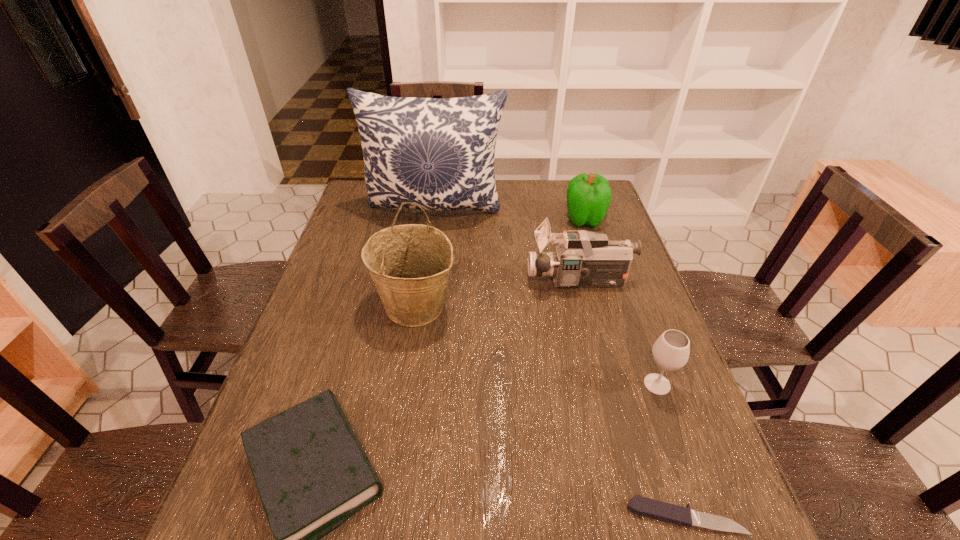
In order to click on vacant space located on the front-facing side of the camcorder in this screenshot , I will do `click(447, 281)`.

You are a GUI agent. You are given a task and a screenshot of the screen. Output one action in this format:
    pyautogui.click(x=<x>, y=<y>)
    Task: Click on the vacant area situated on the left of the bell pepper
    The height and width of the screenshot is (540, 960).
    Given the screenshot: What is the action you would take?
    pyautogui.click(x=472, y=220)

This screenshot has width=960, height=540. Identify the location of vacant position located 0.070m on the left of the third nearest object. (610, 384).

Locate an element on the screen. The image size is (960, 540). vacant space located on the back of the steak knife is located at coordinates (651, 411).

What are the coordinates of `cushion present at the far edge` in the screenshot? It's located at (438, 153).

Find the location of a particular element. Image resolution: width=960 pixels, height=540 pixels. bell pepper that is at the far edge is located at coordinates (588, 196).

At what (x,y) coordinates should I click in order to perform the action: click on object at the near edge. Please return your answer as a coordinate pair (x, y). Looking at the image, I should click on (658, 510).

Image resolution: width=960 pixels, height=540 pixels. I want to click on object that is at the left edge, so click(438, 153).

You are a GUI agent. You are given a task and a screenshot of the screen. Output one action in this format:
    pyautogui.click(x=<x>, y=<y>)
    Task: Click on the camcorder that is positioned at the right edge
    
    Given the screenshot: What is the action you would take?
    pyautogui.click(x=582, y=258)

You are a GUI agent. You are given a task and a screenshot of the screen. Output one action in this format:
    pyautogui.click(x=<x>, y=<y>)
    Task: Click on the bell pepper positioned at the right edge
    Image resolution: width=960 pixels, height=540 pixels.
    Given the screenshot: What is the action you would take?
    pyautogui.click(x=588, y=196)